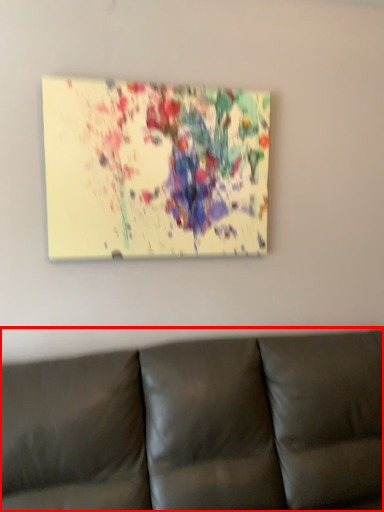
Question: From the image's perspective, where is studio couch (annotated by the red box) located in relation to picture frame in the image?

Choices:
 (A) above
 (B) below

Answer: (B)